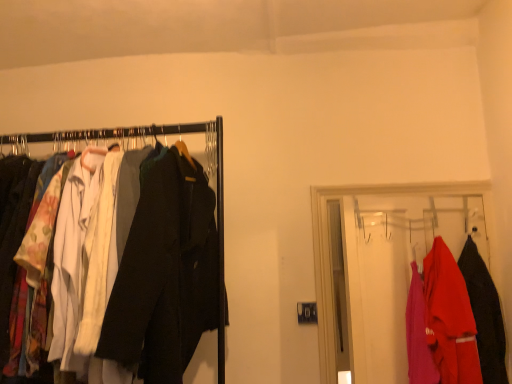
Image resolution: width=512 pixels, height=384 pixels. What do you see at coordinates (358, 261) in the screenshot? I see `matte plastic hanger at right, arranged as the 1th closet when viewed from the right` at bounding box center [358, 261].

The height and width of the screenshot is (384, 512). What do you see at coordinates (155, 137) in the screenshot?
I see `matte black coat rack at left, positioned as the 2th closet in right-to-left order` at bounding box center [155, 137].

At what (x,y) coordinates should I click in order to perform the action: click on matte black coat at right, the 1th fancy dress viewed from the right. Please return your answer as a coordinate pair (x, y). This screenshot has height=384, width=512. Looking at the image, I should click on (485, 314).

At what (x,y) coordinates should I click in order to perform the action: click on matte red shirt at right, which is the 2th fancy dress in right-to-left order. Please return your answer as a coordinate pair (x, y). The width and height of the screenshot is (512, 384). Looking at the image, I should click on (449, 318).

Looking at this image, is matte red shirt at right, the 1th fancy dress from the left, to the left of matte black coat at right, marked as the 2th fancy dress in a left-to-right arrangement, from the viewer's perspective?

Yes, matte red shirt at right, the 1th fancy dress from the left, is to the left of matte black coat at right, marked as the 2th fancy dress in a left-to-right arrangement.

Which object is further away from the camera, matte red shirt at right, the 1th fancy dress from the left, or matte black coat at right, marked as the 2th fancy dress in a left-to-right arrangement?

matte black coat at right, marked as the 2th fancy dress in a left-to-right arrangement, is behind.

From the image's perspective, which object appears higher, matte red shirt at right, the 1th fancy dress from the left, or matte black coat at right, the 1th fancy dress viewed from the right?

matte black coat at right, the 1th fancy dress viewed from the right, appears higher in the image.

From a real-world perspective, which object rests below the other?

matte red shirt at right, the 1th fancy dress from the left.

Considering the sizes of objects matte black coat rack at left, positioned as the 2th closet in right-to-left order, and matte plastic hanger at right, arranged as the second closet when viewed from the left, in the image provided, who is taller, matte black coat rack at left, positioned as the 2th closet in right-to-left order, or matte plastic hanger at right, arranged as the second closet when viewed from the left,?

matte black coat rack at left, positioned as the 2th closet in right-to-left order.

Does point (210, 139) come in front of point (484, 211)?

Yes.

Is matte black coat rack at left, positioned as the 2th closet in right-to-left order, further to camera compared to matte plastic hanger at right, arranged as the 1th closet when viewed from the right?

No, the depth of matte black coat rack at left, positioned as the 2th closet in right-to-left order, is less than that of matte plastic hanger at right, arranged as the 1th closet when viewed from the right.

Is matte black coat rack at left, positioned as the 1th closet in left-to-right order, oriented away from matte plastic hanger at right, arranged as the 1th closet when viewed from the right?

matte black coat rack at left, positioned as the 1th closet in left-to-right order, is not turned away from matte plastic hanger at right, arranged as the 1th closet when viewed from the right.

Identify the location of the 1st closet positioned above the matte black coat at right, marked as the 2th fancy dress in a left-to-right arrangement (from a real-world perspective). tap(358, 261).

Is matte black coat at right, marked as the 2th fancy dress in a left-to-right arrangement, facing away from matte plastic hanger at right, arranged as the 1th closet when viewed from the right?

Yes.

From a real-world perspective, which is physically above, matte black coat at right, marked as the 2th fancy dress in a left-to-right arrangement, or matte plastic hanger at right, arranged as the second closet when viewed from the left?

matte plastic hanger at right, arranged as the second closet when viewed from the left, is physically above.

Is the surface of matte plastic hanger at right, arranged as the second closet when viewed from the left, in direct contact with matte black coat at right, the 1th fancy dress viewed from the right?

They are not placed beside each other.

From their relative heights in the image, would you say matte plastic hanger at right, arranged as the second closet when viewed from the left, is taller or shorter than matte black coat at right, the 1th fancy dress viewed from the right?

Clearly, matte plastic hanger at right, arranged as the second closet when viewed from the left, is taller compared to matte black coat at right, the 1th fancy dress viewed from the right.

Is matte plastic hanger at right, arranged as the second closet when viewed from the left, aimed at matte black coat at right, the 1th fancy dress viewed from the right?

Yes, matte plastic hanger at right, arranged as the second closet when viewed from the left, is oriented towards matte black coat at right, the 1th fancy dress viewed from the right.

From the image's perspective, is matte plastic hanger at right, arranged as the second closet when viewed from the left, beneath matte red shirt at right, which is the 2th fancy dress in right-to-left order?

No, from the image's perspective, matte plastic hanger at right, arranged as the second closet when viewed from the left, is not beneath matte red shirt at right, which is the 2th fancy dress in right-to-left order.

Is matte red shirt at right, the 1th fancy dress from the left, at the back of matte plastic hanger at right, arranged as the 1th closet when viewed from the right?

Correct, matte plastic hanger at right, arranged as the 1th closet when viewed from the right, is looking away from matte red shirt at right, the 1th fancy dress from the left.

What's the angular difference between matte plastic hanger at right, arranged as the second closet when viewed from the left, and matte red shirt at right, which is the 2th fancy dress in right-to-left order,'s facing directions?

matte plastic hanger at right, arranged as the second closet when viewed from the left, and matte red shirt at right, which is the 2th fancy dress in right-to-left order, are facing 91.8 degrees away from each other.

Can you confirm if matte plastic hanger at right, arranged as the 1th closet when viewed from the right, is smaller than matte red shirt at right, the 1th fancy dress from the left?

No, matte plastic hanger at right, arranged as the 1th closet when viewed from the right, is not smaller than matte red shirt at right, the 1th fancy dress from the left.

Is matte plastic hanger at right, arranged as the second closet when viewed from the left, inside matte red shirt at right, the 1th fancy dress from the left?

Definitely not — matte plastic hanger at right, arranged as the second closet when viewed from the left, is not inside matte red shirt at right, the 1th fancy dress from the left.

At what (x,y) coordinates should I click in order to perform the action: click on the 2nd fancy dress positioned below the matte plastic hanger at right, arranged as the second closet when viewed from the left (from a real-world perspective). Please return your answer as a coordinate pair (x, y). This screenshot has width=512, height=384. Looking at the image, I should click on (449, 318).

From a real-world perspective, relative to matte plastic hanger at right, arranged as the second closet when viewed from the left, is matte red shirt at right, the 1th fancy dress from the left, vertically above or below?

In terms of real-world spatial position, matte red shirt at right, the 1th fancy dress from the left, is below matte plastic hanger at right, arranged as the second closet when viewed from the left.

From a real-world perspective, between matte black coat at right, the 1th fancy dress viewed from the right, and matte black coat rack at left, positioned as the 1th closet in left-to-right order, who is vertically lower?

matte black coat at right, the 1th fancy dress viewed from the right, is physically lower.

Does matte black coat at right, the 1th fancy dress viewed from the right, lie behind matte black coat rack at left, positioned as the 2th closet in right-to-left order?

Yes, it is.

Is matte black coat at right, the 1th fancy dress viewed from the right, in contact with matte black coat rack at left, positioned as the 1th closet in left-to-right order?

No, matte black coat at right, the 1th fancy dress viewed from the right, is not making contact with matte black coat rack at left, positioned as the 1th closet in left-to-right order.

Is matte black coat at right, marked as the 2th fancy dress in a left-to-right arrangement, located outside matte black coat rack at left, positioned as the 2th closet in right-to-left order?

Yes, matte black coat at right, marked as the 2th fancy dress in a left-to-right arrangement, is outside of matte black coat rack at left, positioned as the 2th closet in right-to-left order.

Find the location of a particular element. Image resolution: width=512 pixels, height=384 pixels. fancy dress above the matte red shirt at right, the 1th fancy dress from the left (from the image's perspective) is located at coordinates (485, 314).

The height and width of the screenshot is (384, 512). In order to click on closet below the matte black coat rack at left, positioned as the 2th closet in right-to-left order (from a real-world perspective) in this screenshot , I will do `click(358, 261)`.

From the picture: Considering their positions, is matte red shirt at right, which is the 2th fancy dress in right-to-left order, positioned closer to matte black coat at right, the 1th fancy dress viewed from the right, than matte black coat rack at left, positioned as the 2th closet in right-to-left order?

matte red shirt at right, which is the 2th fancy dress in right-to-left order, is closer to matte black coat at right, the 1th fancy dress viewed from the right.

Estimate the real-world distances between objects in this image. Which object is closer to matte black coat rack at left, positioned as the 1th closet in left-to-right order, matte red shirt at right, which is the 2th fancy dress in right-to-left order, or matte plastic hanger at right, arranged as the 1th closet when viewed from the right?

matte plastic hanger at right, arranged as the 1th closet when viewed from the right, lies closer to matte black coat rack at left, positioned as the 1th closet in left-to-right order, than the other object.

Based on the photo, considering their positions, is matte plastic hanger at right, arranged as the second closet when viewed from the left, positioned closer to matte black coat at right, marked as the 2th fancy dress in a left-to-right arrangement, than matte red shirt at right, the 1th fancy dress from the left?

matte red shirt at right, the 1th fancy dress from the left, lies closer to matte black coat at right, marked as the 2th fancy dress in a left-to-right arrangement, than the other object.

From the image, which object appears to be nearer to matte plastic hanger at right, arranged as the second closet when viewed from the left, matte red shirt at right, the 1th fancy dress from the left, or matte black coat at right, the 1th fancy dress viewed from the right?

matte red shirt at right, the 1th fancy dress from the left.

Looking at the image, which one is located further to matte red shirt at right, which is the 2th fancy dress in right-to-left order, matte plastic hanger at right, arranged as the second closet when viewed from the left, or matte black coat rack at left, positioned as the 1th closet in left-to-right order?

matte black coat rack at left, positioned as the 1th closet in left-to-right order.

Which object lies nearer to the anchor point matte black coat rack at left, positioned as the 2th closet in right-to-left order, matte red shirt at right, which is the 2th fancy dress in right-to-left order, or matte black coat at right, the 1th fancy dress viewed from the right?

matte red shirt at right, which is the 2th fancy dress in right-to-left order, is closer to matte black coat rack at left, positioned as the 2th closet in right-to-left order.

Based on their spatial positions, is matte black coat at right, the 1th fancy dress viewed from the right, or matte black coat rack at left, positioned as the 1th closet in left-to-right order, closer to matte plastic hanger at right, arranged as the 1th closet when viewed from the right?

Among the two, matte black coat at right, the 1th fancy dress viewed from the right, is located nearer to matte plastic hanger at right, arranged as the 1th closet when viewed from the right.

Estimate the real-world distances between objects in this image. Which object is closer to matte plastic hanger at right, arranged as the 1th closet when viewed from the right, matte red shirt at right, which is the 2th fancy dress in right-to-left order, or matte black coat rack at left, positioned as the 2th closet in right-to-left order?

Among the two, matte red shirt at right, which is the 2th fancy dress in right-to-left order, is located nearer to matte plastic hanger at right, arranged as the 1th closet when viewed from the right.

You are a GUI agent. You are given a task and a screenshot of the screen. Output one action in this format:
    pyautogui.click(x=<x>, y=<y>)
    Task: Click on the closet between matte black coat rack at left, positioned as the 2th closet in right-to-left order, and matte red shirt at right, which is the 2th fancy dress in right-to-left order, in the horizontal direction
    
    Given the screenshot: What is the action you would take?
    pyautogui.click(x=358, y=261)

Identify the location of fancy dress situated between matte black coat rack at left, positioned as the 2th closet in right-to-left order, and matte black coat at right, marked as the 2th fancy dress in a left-to-right arrangement, from left to right. (449, 318).

You are a GUI agent. You are given a task and a screenshot of the screen. Output one action in this format:
    pyautogui.click(x=<x>, y=<y>)
    Task: Click on the closet located between matte black coat rack at left, positioned as the 2th closet in right-to-left order, and matte black coat at right, the 1th fancy dress viewed from the right, in the left-right direction
    The image size is (512, 384).
    Given the screenshot: What is the action you would take?
    pyautogui.click(x=358, y=261)

You are a GUI agent. You are given a task and a screenshot of the screen. Output one action in this format:
    pyautogui.click(x=<x>, y=<y>)
    Task: Click on the fancy dress between matte plastic hanger at right, arranged as the second closet when viewed from the left, and matte black coat at right, the 1th fancy dress viewed from the right, in the horizontal direction
    The height and width of the screenshot is (384, 512).
    Given the screenshot: What is the action you would take?
    pyautogui.click(x=449, y=318)